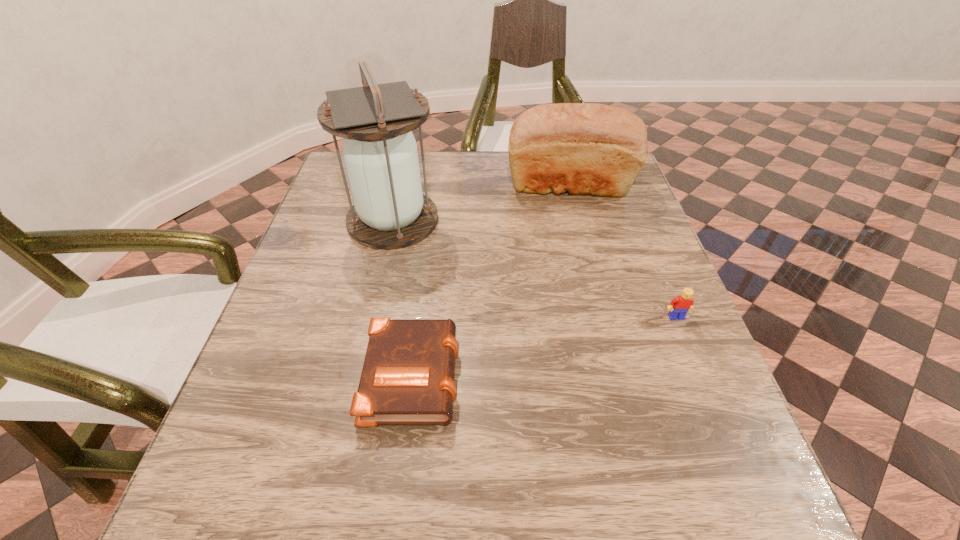
At what (x,y) coordinates should I click in order to perform the action: click on lantern. Please return your answer as a coordinate pair (x, y). Looking at the image, I should click on (390, 211).

Locate an element on the screen. This screenshot has width=960, height=540. bread is located at coordinates (584, 148).

What are the coordinates of `the third farthest object` in the screenshot? It's located at (679, 306).

The width and height of the screenshot is (960, 540). In order to click on the third tallest object in this screenshot , I will do `click(679, 306)`.

Where is `Bible`? This screenshot has width=960, height=540. Bible is located at coordinates (407, 378).

The width and height of the screenshot is (960, 540). In order to click on the shortest object in this screenshot , I will do `click(407, 378)`.

Locate an element on the screen. free space located 0.240m on the front of the tallest object is located at coordinates (368, 334).

I want to click on vacant region located on the left of the third shortest object, so click(458, 185).

This screenshot has width=960, height=540. Identify the location of free space located on the face of the second shortest object. (763, 531).

Locate an element on the screen. This screenshot has height=540, width=960. vacant space located on the spine side of the nearest object is located at coordinates (644, 373).